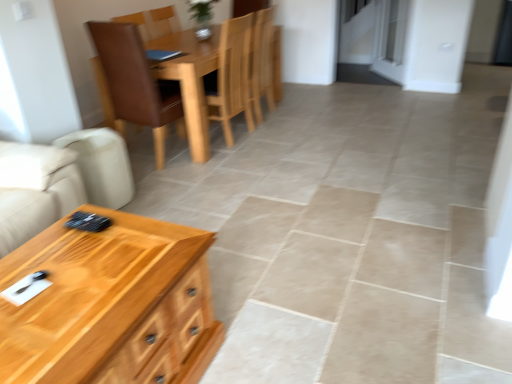
You are a GUI agent. You are given a task and a screenshot of the screen. Output one action in this format:
    pyautogui.click(x=<x>, y=<y>)
    Task: Click on the free space above wooden coffee table at lower left (from a real-world perspective)
    
    Given the screenshot: What is the action you would take?
    pyautogui.click(x=83, y=280)